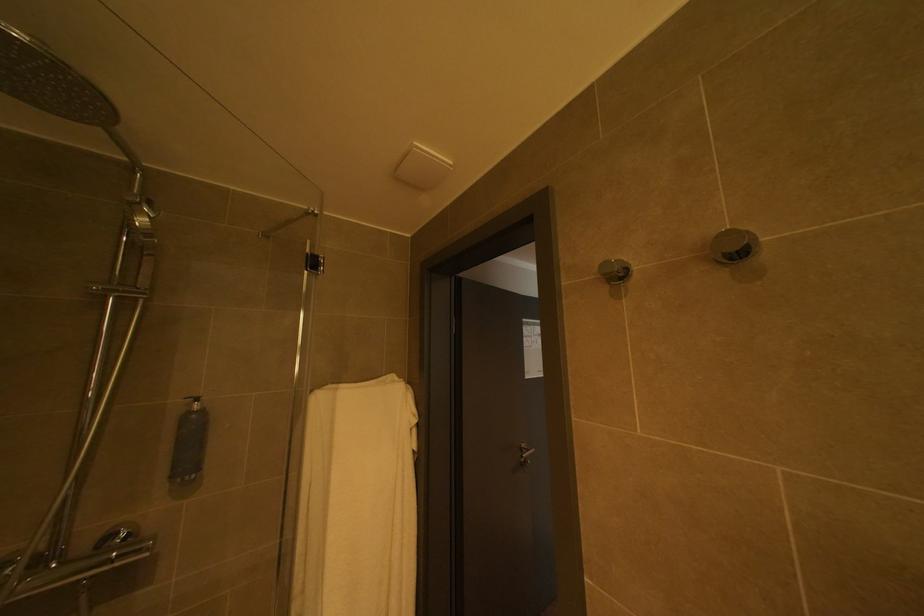
At what (x,y) coordinates should I click in order to perform the action: click on shower control knob. Please return your answer as a coordinate pair (x, y). Looking at the image, I should click on (116, 535).